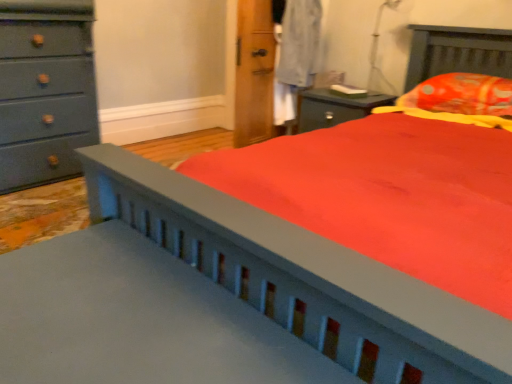
Question: Is orange printed fabric pillow at upper right to the right of transparent plastic table lamp at upper right from the viewer's perspective?

Choices:
 (A) yes
 (B) no

Answer: (A)

Question: Is orange printed fabric pillow at upper right looking in the opposite direction of transparent plastic table lamp at upper right?

Choices:
 (A) yes
 (B) no

Answer: (B)

Question: Would you say orange printed fabric pillow at upper right is outside transparent plastic table lamp at upper right?

Choices:
 (A) no
 (B) yes

Answer: (B)

Question: Are orange printed fabric pillow at upper right and transparent plastic table lamp at upper right located far from each other?

Choices:
 (A) yes
 (B) no

Answer: (B)

Question: Is orange printed fabric pillow at upper right with transparent plastic table lamp at upper right?

Choices:
 (A) no
 (B) yes

Answer: (A)

Question: From a real-world perspective, is orange printed fabric pillow at upper right on transparent plastic table lamp at upper right?

Choices:
 (A) no
 (B) yes

Answer: (A)

Question: Considering the relative positions of transparent plastic table lamp at upper right and orange printed fabric pillow at upper right in the image provided, is transparent plastic table lamp at upper right to the right of orange printed fabric pillow at upper right from the viewer's perspective?

Choices:
 (A) yes
 (B) no

Answer: (B)

Question: From the image's perspective, is transparent plastic table lamp at upper right on top of orange printed fabric pillow at upper right?

Choices:
 (A) no
 (B) yes

Answer: (B)

Question: Considering the relative sizes of transparent plastic table lamp at upper right and orange printed fabric pillow at upper right in the image provided, is transparent plastic table lamp at upper right wider than orange printed fabric pillow at upper right?

Choices:
 (A) no
 (B) yes

Answer: (A)

Question: From the image's perspective, does transparent plastic table lamp at upper right appear lower than orange printed fabric pillow at upper right?

Choices:
 (A) yes
 (B) no

Answer: (B)

Question: Is transparent plastic table lamp at upper right in front of orange printed fabric pillow at upper right?

Choices:
 (A) no
 (B) yes

Answer: (A)

Question: Is transparent plastic table lamp at upper right not inside orange printed fabric pillow at upper right?

Choices:
 (A) no
 (B) yes

Answer: (B)

Question: From the image's perspective, does transparent plastic table lamp at upper right appear lower than matte gray dresser at left?

Choices:
 (A) yes
 (B) no

Answer: (B)